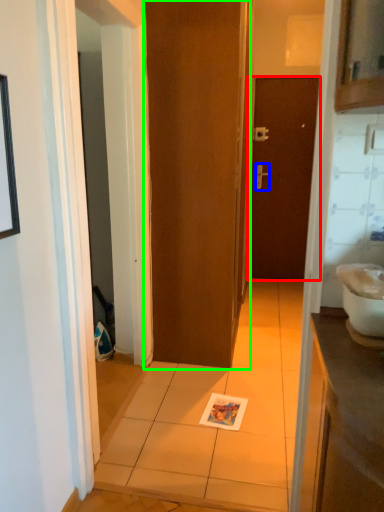
Question: Considering the real-world distances, which object is closest to door (highlighted by a red box)? door handle (highlighted by a blue box) or door (highlighted by a green box).

Choices:
 (A) door handle
 (B) door

Answer: (A)